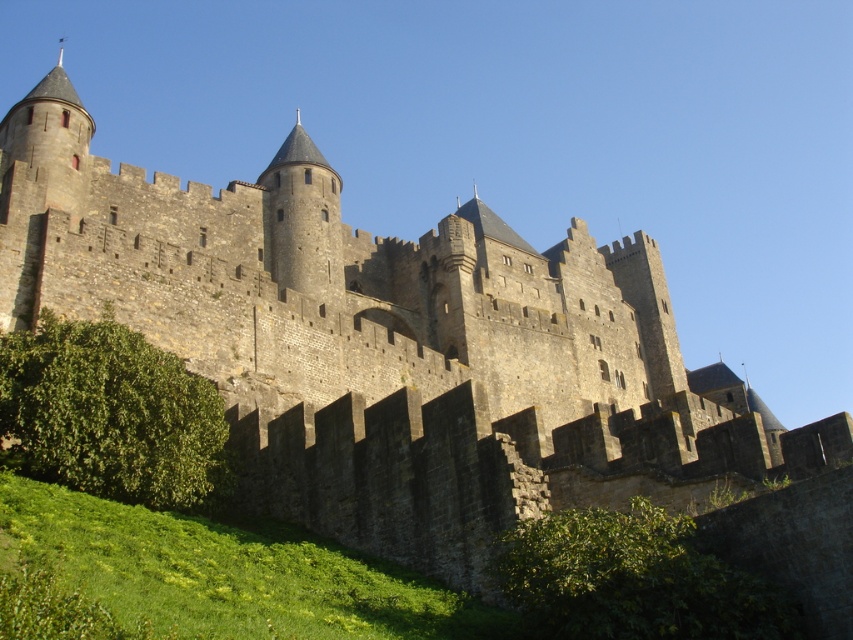
Question: Does green leafy hedge at lower left have a larger size compared to green leafy hedge at lower center?

Choices:
 (A) no
 (B) yes

Answer: (B)

Question: Is green leafy hedge at lower left to the left of green leafy hedge at lower center from the viewer's perspective?

Choices:
 (A) no
 (B) yes

Answer: (B)

Question: Is green leafy hedge at lower left closer to camera compared to green leafy hedge at lower center?

Choices:
 (A) no
 (B) yes

Answer: (A)

Question: Which point is farther from the camera taking this photo?

Choices:
 (A) (126, 465)
 (B) (676, 531)

Answer: (A)